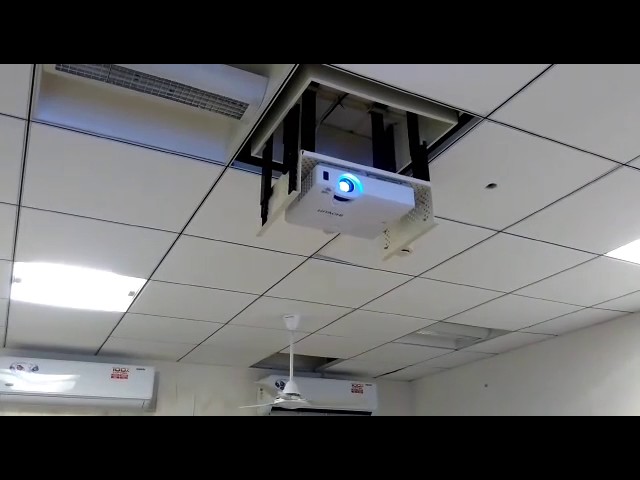
Identify the location of projector casing. This screenshot has height=480, width=640. (370, 215).